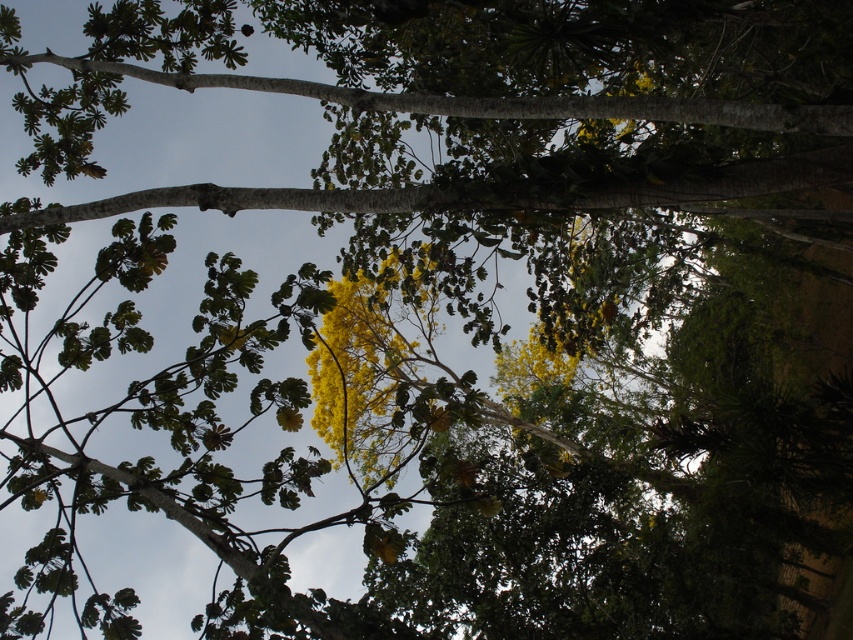
Question: Which point is farther to the camera?

Choices:
 (A) smooth bark branch at upper center
 (B) green leafy branch at upper center

Answer: (B)

Question: Can you confirm if green leafy branch at upper center is smaller than smooth bark branch at upper center?

Choices:
 (A) yes
 (B) no

Answer: (B)

Question: Does green leafy branch at upper center have a greater width compared to smooth bark branch at upper center?

Choices:
 (A) no
 (B) yes

Answer: (B)

Question: From the image, what is the correct spatial relationship of green leafy branch at upper center in relation to smooth bark branch at upper center?

Choices:
 (A) right
 (B) left

Answer: (B)

Question: Which point appears farthest from the camera in this image?

Choices:
 (A) (303, 202)
 (B) (645, 108)

Answer: (A)